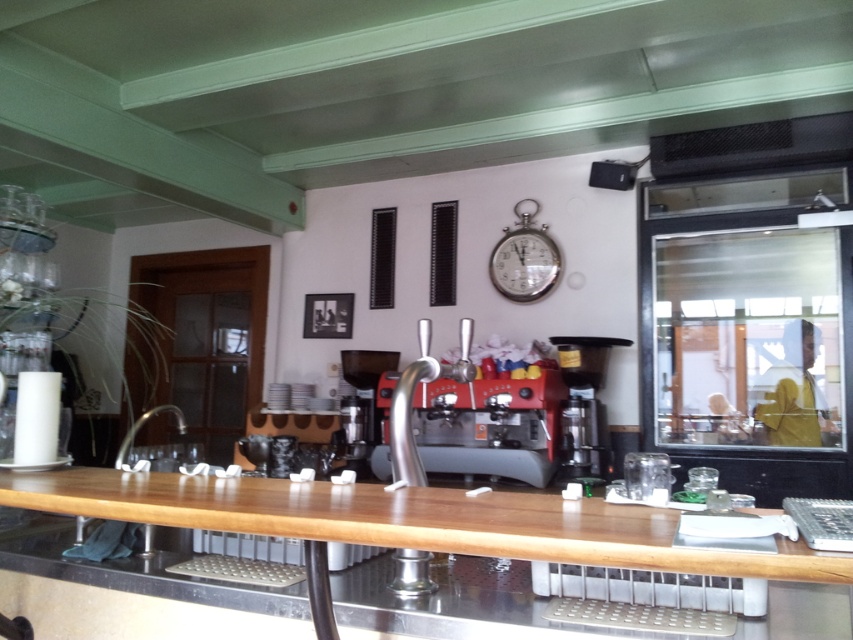
Consider the image. Is wooden at center taller than silver metallic clock at upper center?

No.

Is wooden at center wider than silver metallic clock at upper center?

Yes, wooden at center is wider than silver metallic clock at upper center.

Which is in front, point (415, 531) or point (502, 230)?

Point (415, 531) is in front.

Identify the location of wooden at center. (402, 520).

Which is in front, point (637, 554) or point (589, 364)?

Point (637, 554) is more forward.

Between point (294, 515) and point (577, 449), which one is positioned behind?

Positioned behind is point (577, 449).

Find the location of `wooden at center`. wooden at center is located at coordinates (402, 520).

Between black plastic coffee machine at center and silver metallic clock at upper center, which one appears on the right side from the viewer's perspective?

Positioned to the right is black plastic coffee machine at center.

Can you confirm if black plastic coffee machine at center is bigger than silver metallic clock at upper center?

Indeed, black plastic coffee machine at center has a larger size compared to silver metallic clock at upper center.

The height and width of the screenshot is (640, 853). I want to click on black plastic coffee machine at center, so click(x=585, y=440).

Where is `black plastic coffee machine at center`? The image size is (853, 640). black plastic coffee machine at center is located at coordinates (585, 440).